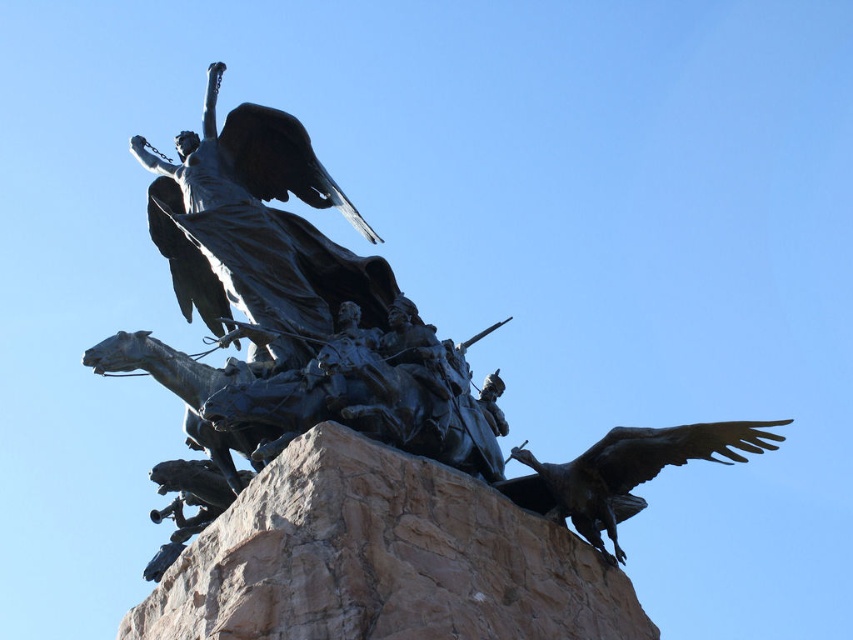
Can you confirm if bronze statue at center is taller than bronze eagle at lower right?

Correct, bronze statue at center is much taller as bronze eagle at lower right.

Who is more forward, (186, 404) or (527, 490)?

Point (527, 490) is in front.

What do you see at coordinates (338, 344) in the screenshot?
I see `bronze statue at center` at bounding box center [338, 344].

The image size is (853, 640). In order to click on bronze statue at center in this screenshot , I will do `click(338, 344)`.

Which is more to the left, brown rough stone at center or bronze eagle at lower right?

From the viewer's perspective, brown rough stone at center appears more on the left side.

Can you confirm if brown rough stone at center is smaller than bronze eagle at lower right?

Correct, brown rough stone at center occupies less space than bronze eagle at lower right.

Does point (376, 506) come in front of point (714, 432)?

That is True.

The height and width of the screenshot is (640, 853). I want to click on brown rough stone at center, so click(x=381, y=560).

Is point (422, 369) closer to camera compared to point (289, 476)?

No, (422, 369) is further to viewer.

Find the location of `bronze statue at center`. bronze statue at center is located at coordinates (338, 344).